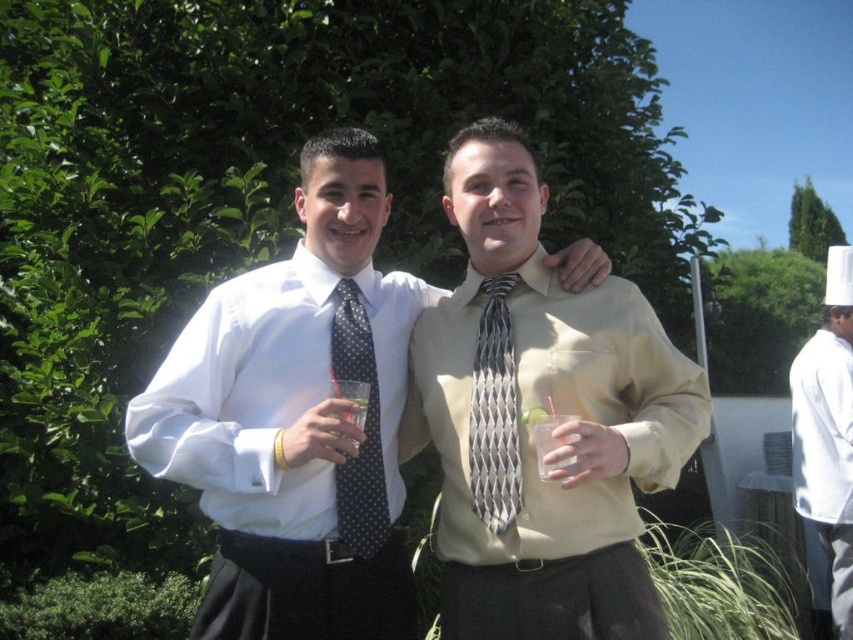
Question: Does white glossy shirt at center appear under silver metallic tie at center?

Choices:
 (A) yes
 (B) no

Answer: (B)

Question: Can you confirm if silver metallic tie at center is positioned above clear glass at center?

Choices:
 (A) yes
 (B) no

Answer: (A)

Question: Does silver metallic tie at center appear under clear plastic cup at center?

Choices:
 (A) yes
 (B) no

Answer: (B)

Question: Considering the real-world distances, which object is closest to the white chef hat at upper right?

Choices:
 (A) clear glass at center
 (B) white glossy shirt at center
 (C) polka dot silk tie at center
 (D) silver metallic tie at center

Answer: (D)

Question: Which object is closer to the camera taking this photo?

Choices:
 (A) white glossy shirt at center
 (B) white chef hat at upper right
 (C) matte beige shirt at center
 (D) clear glass at center

Answer: (C)

Question: Among these points, which one is nearest to the camera?

Choices:
 (A) (373, 420)
 (B) (572, 467)
 (C) (526, 486)
 (D) (357, 404)

Answer: (B)